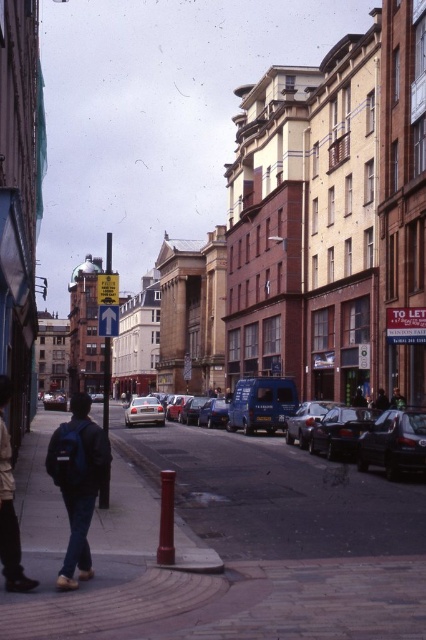
Question: Which of the following is the farthest from the observer?

Choices:
 (A) blue metallic van at center
 (B) shiny blue van at center

Answer: (B)

Question: Does blue metallic van at center have a smaller size compared to dark blue jeans at lower left?

Choices:
 (A) yes
 (B) no

Answer: (B)

Question: From the image, what is the correct spatial relationship of blue metallic van at center in relation to silver metallic car at center?

Choices:
 (A) left
 (B) right

Answer: (B)

Question: Based on their relative distances, which object is nearer to the shiny black car at center?

Choices:
 (A) dark blue jeans at lower left
 (B) shiny black car at right
 (C) blue metallic van at center

Answer: (C)

Question: Which point appears closest to the camera in this image?

Choices:
 (A) (382, 444)
 (B) (199, 419)
 (C) (394, 392)
 (D) (152, 412)

Answer: (A)

Question: Does dark blue backpack at lower left have a smaller size compared to shiny black car at center?

Choices:
 (A) no
 (B) yes

Answer: (A)